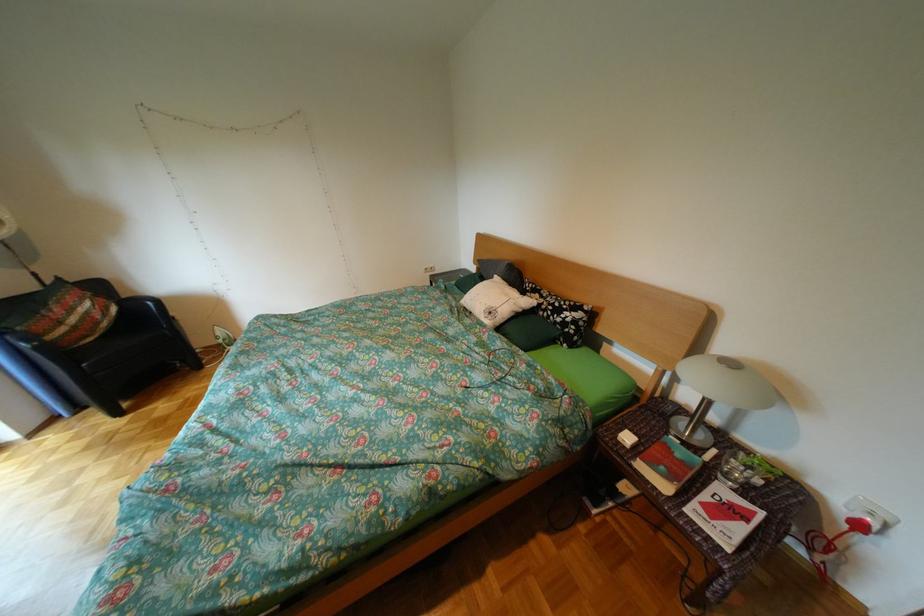
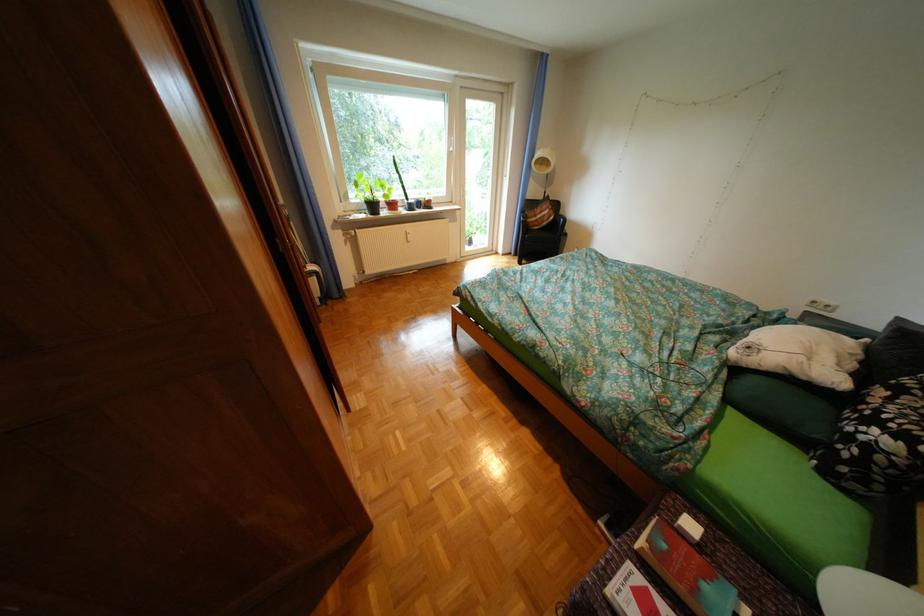
Find the pixel in the second image that matches [555,297] in the first image.

(904, 399)